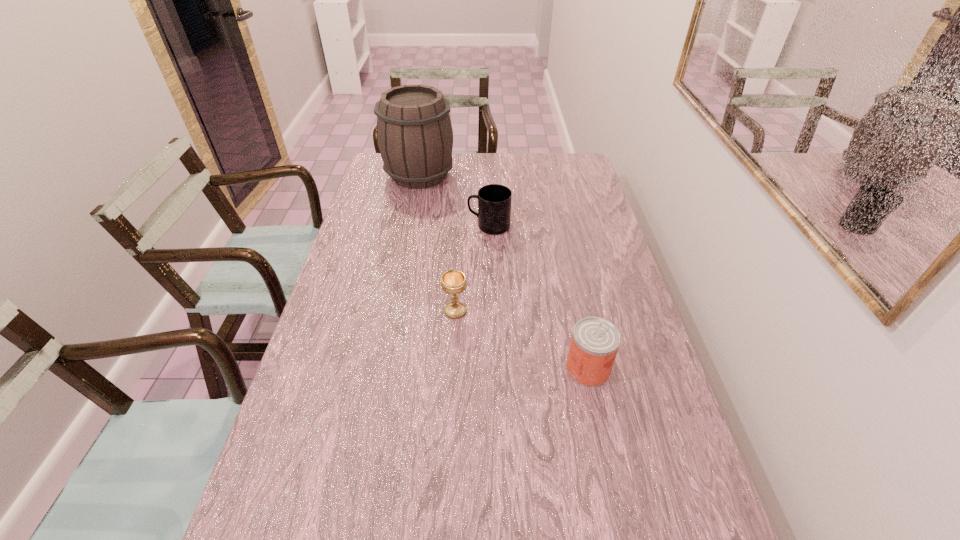
Locate an element on the screen. vacant region that satisfies the following two spatial constraints: 1. on the front side of the can; 2. on the right side of the tallest object is located at coordinates (382, 369).

Locate an element on the screen. The width and height of the screenshot is (960, 540). free spot that satisfies the following two spatial constraints: 1. on the front side of the wine bucket; 2. on the right side of the second nearest object is located at coordinates (393, 311).

In order to click on free point that satisfies the following two spatial constraints: 1. on the front side of the nearest object; 2. on the right side of the second nearest object in this screenshot , I will do `click(452, 369)`.

At what (x,y) coordinates should I click in order to perform the action: click on free space in the image that satisfies the following two spatial constraints: 1. on the front side of the tallest object; 2. on the right side of the chalice. Please return your answer as a coordinate pair (x, y). Looking at the image, I should click on (393, 311).